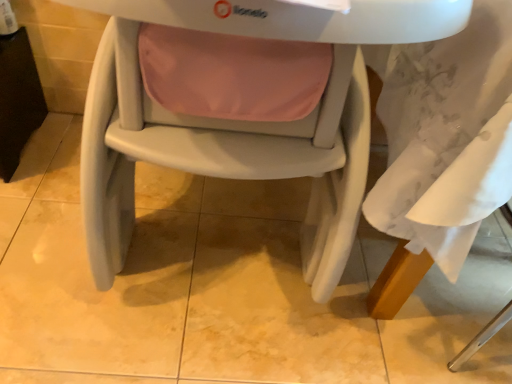
The image size is (512, 384). What are the coordinates of `matte plastic highchair at center` in the screenshot? It's located at (222, 156).

Image resolution: width=512 pixels, height=384 pixels. What do you see at coordinates (222, 156) in the screenshot?
I see `matte plastic highchair at center` at bounding box center [222, 156].

This screenshot has height=384, width=512. Describe the element at coordinates (18, 99) in the screenshot. I see `black plastic table at left` at that location.

What is the approximate width of black plastic table at left?

black plastic table at left is 13.25 inches in width.

Find the location of a particular element. The height and width of the screenshot is (384, 512). black plastic table at left is located at coordinates (18, 99).

Identify the location of matte plastic highchair at center. (222, 156).

Based on their positions, is black plastic table at left located to the left or right of matte plastic highchair at center?

In the image, black plastic table at left appears on the left side of matte plastic highchair at center.

Relative to matte plastic highchair at center, is black plastic table at left in front or behind?

black plastic table at left is behind matte plastic highchair at center.

Which point is more forward, (19,98) or (332,110)?

The point (332,110) is closer to the camera.

From the image's perspective, relative to matte plastic highchair at center, is black plastic table at left above or below?

black plastic table at left is above matte plastic highchair at center.

From a real-world perspective, between black plastic table at left and matte plastic highchair at center, who is vertically higher?

In real-world perspective, matte plastic highchair at center is above.

Looking at their sizes, would you say black plastic table at left is wider or thinner than matte plastic highchair at center?

In the image, black plastic table at left appears to be more narrow than matte plastic highchair at center.

Which of these two, black plastic table at left or matte plastic highchair at center, stands taller?

matte plastic highchair at center.

Considering the relative sizes of black plastic table at left and matte plastic highchair at center in the image provided, is black plastic table at left bigger than matte plastic highchair at center?

Actually, black plastic table at left might be smaller than matte plastic highchair at center.

Would you say black plastic table at left is outside matte plastic highchair at center?

That's correct, black plastic table at left is outside of matte plastic highchair at center.

Would you consider black plastic table at left to be distant from matte plastic highchair at center?

They are positioned close to each other.

Is black plastic table at left oriented towards matte plastic highchair at center?

No, black plastic table at left is not oriented towards matte plastic highchair at center.

How different are the orientations of black plastic table at left and matte plastic highchair at center in degrees?

The facing directions of black plastic table at left and matte plastic highchair at center are 0.213 degrees apart.

How far apart are black plastic table at left and matte plastic highchair at center?

black plastic table at left is 26.76 inches from matte plastic highchair at center.

Find the location of a particular element. Image resolution: width=512 pixels, height=384 pixels. chair located below the black plastic table at left (from the image's perspective) is located at coordinates (222, 156).

Considering the positions of objects matte plastic highchair at center and black plastic table at left in the image provided, who is more to the right, matte plastic highchair at center or black plastic table at left?

Positioned to the right is matte plastic highchair at center.

Considering the positions of objects matte plastic highchair at center and black plastic table at left in the image provided, who is in front, matte plastic highchair at center or black plastic table at left?

matte plastic highchair at center is in front.

Is point (285, 159) farther from viewer compared to point (0, 73)?

No, (285, 159) is closer to viewer.

From the image's perspective, is matte plastic highchair at center located beneath black plastic table at left?

Yes.

From a real-world perspective, which is physically below, matte plastic highchair at center or black plastic table at left?

From a 3D spatial view, black plastic table at left is below.

Considering the sizes of objects matte plastic highchair at center and black plastic table at left in the image provided, who is wider, matte plastic highchair at center or black plastic table at left?

matte plastic highchair at center is wider.

Is matte plastic highchair at center taller or shorter than black plastic table at left?

Clearly, matte plastic highchair at center is taller compared to black plastic table at left.

Considering the sizes of objects matte plastic highchair at center and black plastic table at left in the image provided, who is smaller, matte plastic highchair at center or black plastic table at left?

black plastic table at left is smaller.

Would you say matte plastic highchair at center contains black plastic table at left?

Actually, black plastic table at left is outside matte plastic highchair at center.

Is matte plastic highchair at center not close to black plastic table at left?

No, matte plastic highchair at center is not far from black plastic table at left.

Is matte plastic highchair at center turned away from black plastic table at left?

No, matte plastic highchair at center is not facing away from black plastic table at left.

Where is `table on the left of matte plastic highchair at center`? Image resolution: width=512 pixels, height=384 pixels. table on the left of matte plastic highchair at center is located at coordinates (18, 99).

Identify the location of table above the matte plastic highchair at center (from the image's perspective). The image size is (512, 384). (18, 99).

Where is `table beneath the matte plastic highchair at center (from a real-world perspective)`? table beneath the matte plastic highchair at center (from a real-world perspective) is located at coordinates (18, 99).